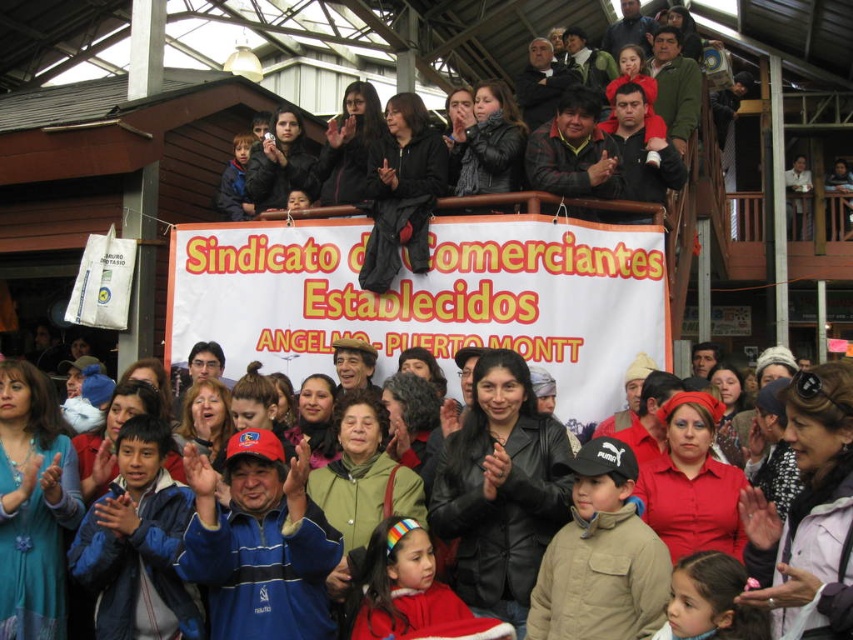
You are a photographer standing at the camera position. You want to take a closeup shot of the tan fleece jacket at center. Can you estimate how far you need to move forward to get a clear closeup?

The tan fleece jacket at center is 35.26 meters from the camera. To get a clear closeup, you would need to move forward approximately 35.26 meters to be closer to the jacket.